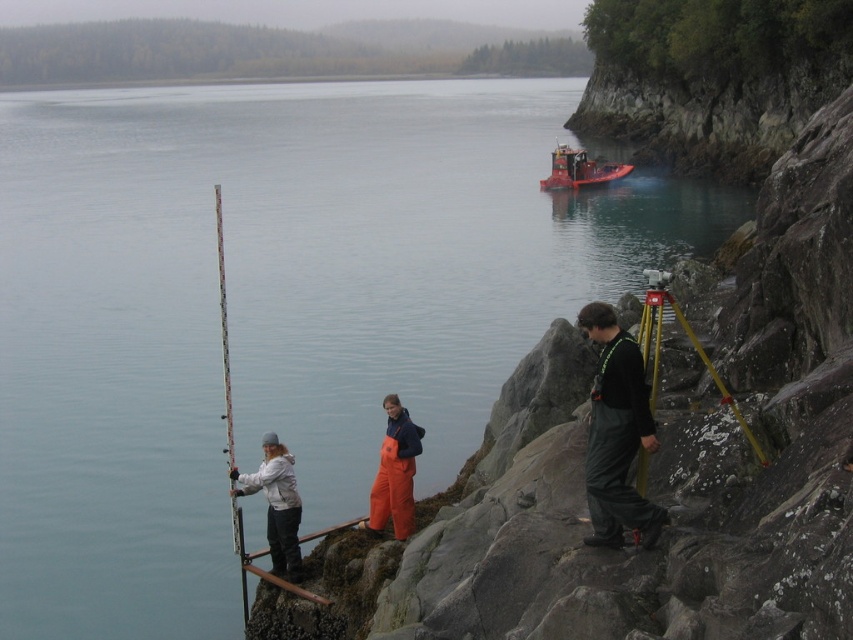
Which is more to the right, white fleece jacket at center or orange waterproof overalls at center?

orange waterproof overalls at center is more to the right.

Based on the photo, is white fleece jacket at center positioned in front of orange waterproof overalls at center?

Yes, it is.

Is point (270, 458) farther from camera compared to point (375, 513)?

That is False.

You are a GUI agent. You are given a task and a screenshot of the screen. Output one action in this format:
    pyautogui.click(x=<x>, y=<y>)
    Task: Click on the white fleece jacket at center
    This screenshot has width=853, height=640.
    Given the screenshot: What is the action you would take?
    pyautogui.click(x=276, y=504)

Which of these two, dark gray rubber boots at right or red rubber boat at center, stands taller?

red rubber boat at center is taller.

Does dark gray rubber boots at right appear on the right side of red rubber boat at center?

In fact, dark gray rubber boots at right is to the left of red rubber boat at center.

At what (x,y) coordinates should I click in order to perform the action: click on dark gray rubber boots at right. Please return your answer as a coordinate pair (x, y). Looking at the image, I should click on (616, 435).

Is point (396, 484) farther from viewer compared to point (245, 576)?

Yes.

Which is more to the right, orange waterproof overalls at center or white plastic fishing pole at left?

orange waterproof overalls at center is more to the right.

I want to click on orange waterproof overalls at center, so tap(395, 472).